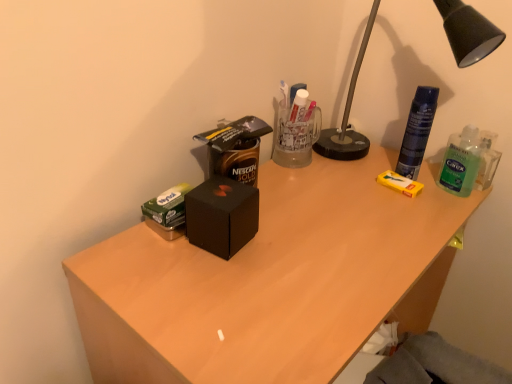
At what (x,y) coordinates should I click in order to perform the action: click on vacant space in front of black metal lamp at upper right. Please return your answer as a coordinate pair (x, y). The width and height of the screenshot is (512, 384). Looking at the image, I should click on (371, 218).